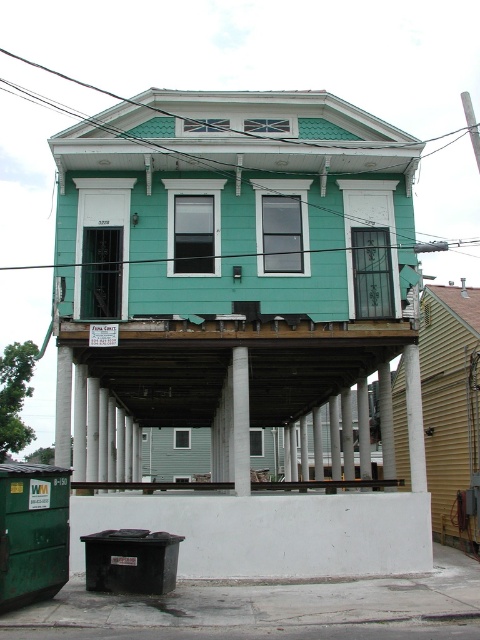
Is green matte dumpster at lower left thinner than metallic silver rail at lower center?

Correct, green matte dumpster at lower left's width is less than metallic silver rail at lower center's.

Which is in front, point (22, 577) or point (310, 484)?

Positioned in front is point (22, 577).

Which is in front, point (60, 508) or point (300, 486)?

Point (60, 508) is in front.

Image resolution: width=480 pixels, height=640 pixels. In order to click on green matte dumpster at lower left in this screenshot , I will do `click(33, 532)`.